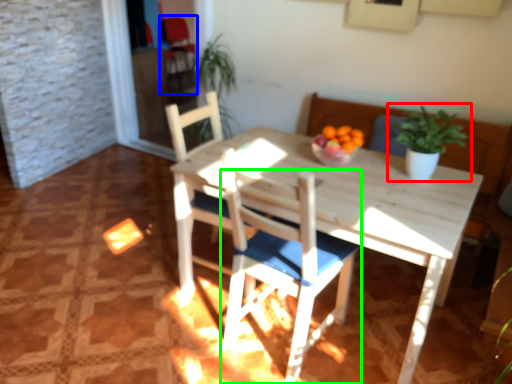
Question: Based on their relative distances, which object is farther from houseplant (highlighted by a red box)? Choose from armchair (highlighted by a blue box) and chair (highlighted by a green box).

Choices:
 (A) armchair
 (B) chair

Answer: (A)